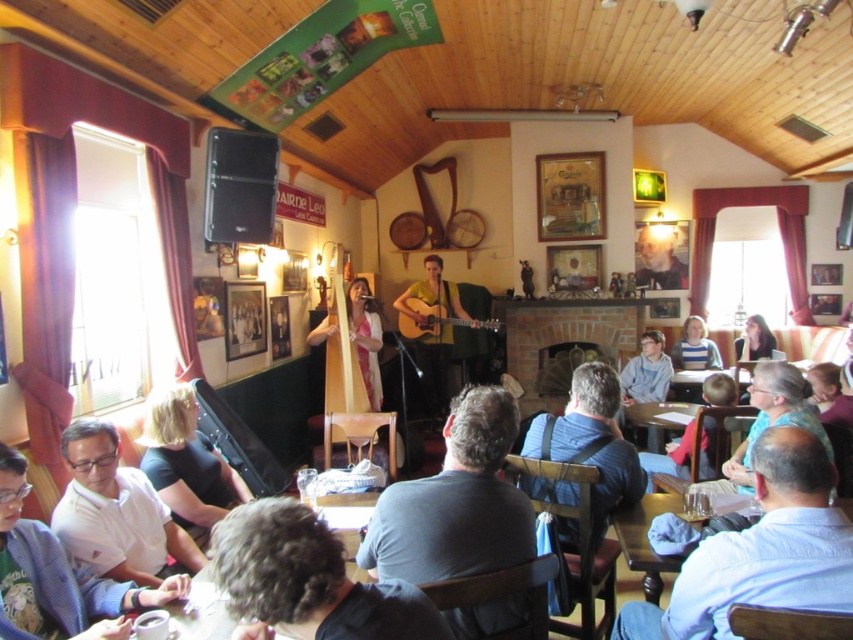
You are standing in the pub and want to move from one point to another. If you start at point (x=471, y=605) and walk towards point (x=340, y=387), will you be moving towards the back of the room or towards the front?

Since point (x=471, y=605) is closer to the viewer than point (x=340, y=387), moving from the former to the latter means you are walking towards the back of the room.

You are a photographer setting up for a live event. You need to position a camera to capture both the blue shirt at lower right and the matte black microphone at center. Which object should you ensure is framed first to account for their size difference?

The blue shirt at lower right should be framed first since it has a larger width than the matte black microphone at center, ensuring it fits properly in the frame.